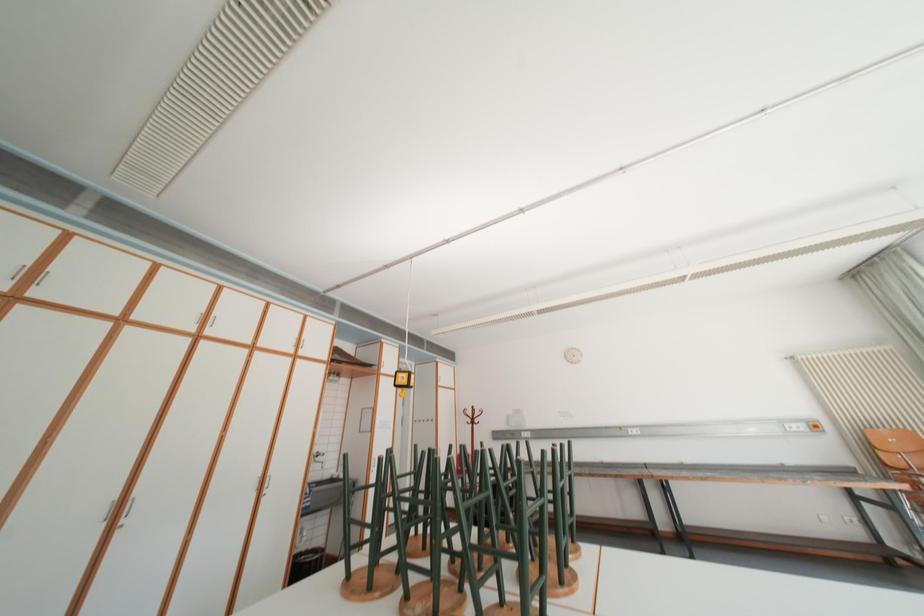
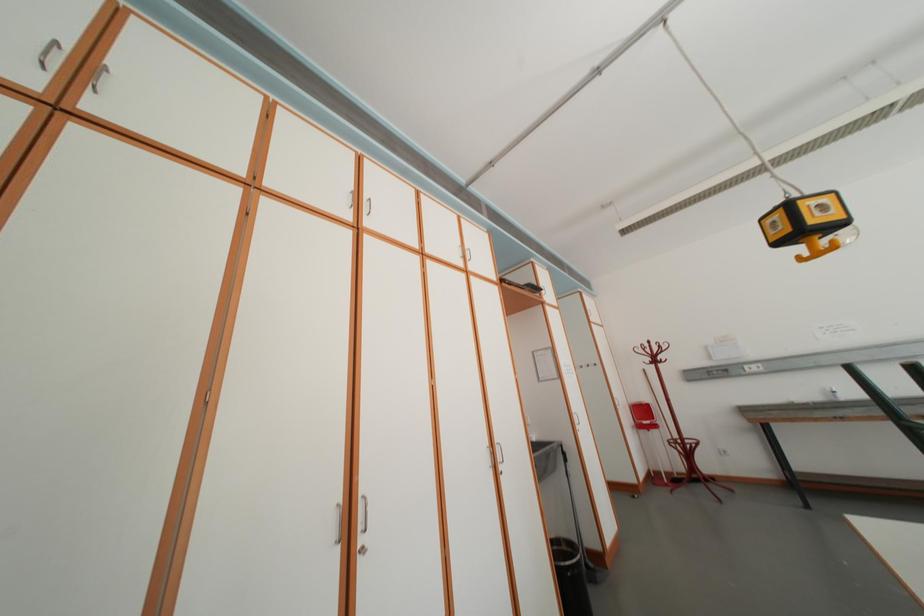
What movement of the cameraman would produce the second image?

The movement direction of the cameraman is left, forward.